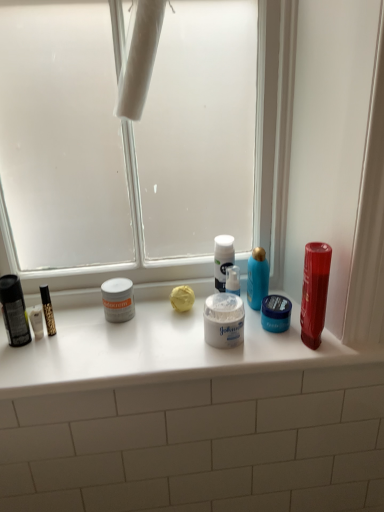
This screenshot has width=384, height=512. In order to click on vacant area that lies between shiny plastic mouthwash at right and white matte jar at center in this screenshot , I will do `click(275, 343)`.